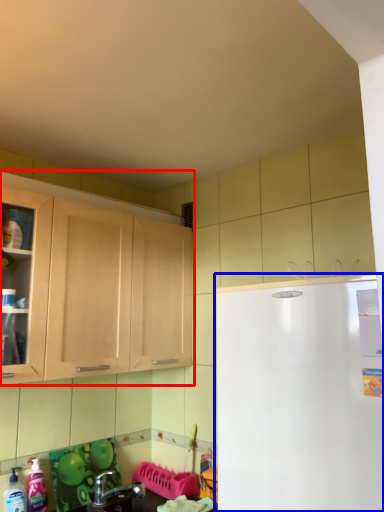
Question: Which object is further to the camera taking this photo, cabinetry (highlighted by a red box) or refrigerator (highlighted by a blue box)?

Choices:
 (A) cabinetry
 (B) refrigerator

Answer: (A)